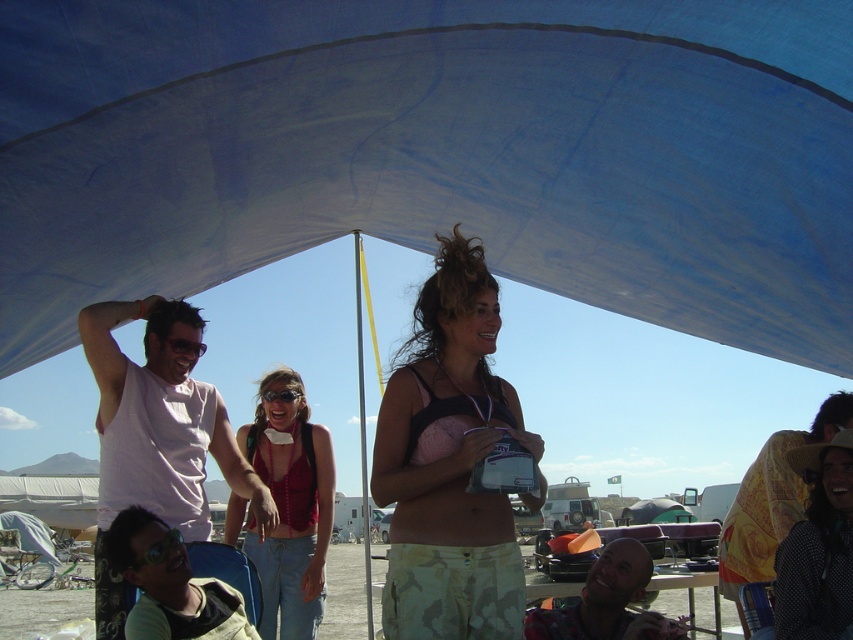
Can you confirm if blue fabric canopy at upper center is bigger than polka dot fabric hat at lower right?

Yes.

In the scene shown: Is blue fabric canopy at upper center smaller than polka dot fabric hat at lower right?

No.

In order to click on blue fabric canopy at upper center in this screenshot , I will do `click(434, 154)`.

Does white matte tank top at left have a greater height compared to black plastic goggles at center?

Correct, white matte tank top at left is much taller as black plastic goggles at center.

Looking at this image, does white matte tank top at left appear over black plastic goggles at center?

No, white matte tank top at left is not above black plastic goggles at center.

Find the location of `white matte tank top at left`. white matte tank top at left is located at coordinates (161, 419).

Locate an element on the screen. green matte sunglasses at lower left is located at coordinates (169, 584).

Can you confirm if green matte sunglasses at lower left is positioned to the right of transparent plastic goggles at lower left?

Yes, green matte sunglasses at lower left is to the right of transparent plastic goggles at lower left.

Who is more forward, (154,564) or (171,545)?

Positioned in front is point (154,564).

You are a GUI agent. You are given a task and a screenshot of the screen. Output one action in this format:
    pyautogui.click(x=<x>, y=<y>)
    Task: Click on the green matte sunglasses at lower left
    
    Given the screenshot: What is the action you would take?
    pyautogui.click(x=169, y=584)